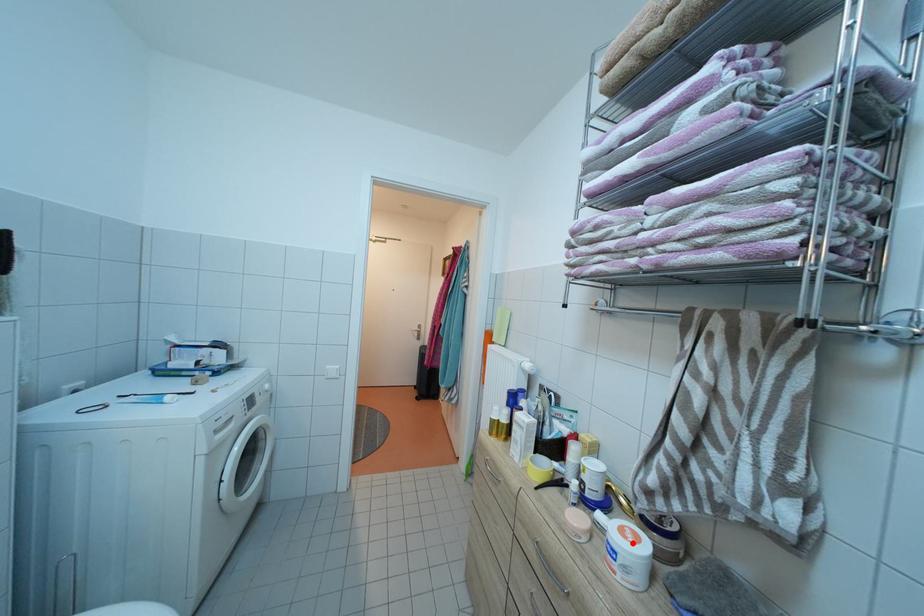
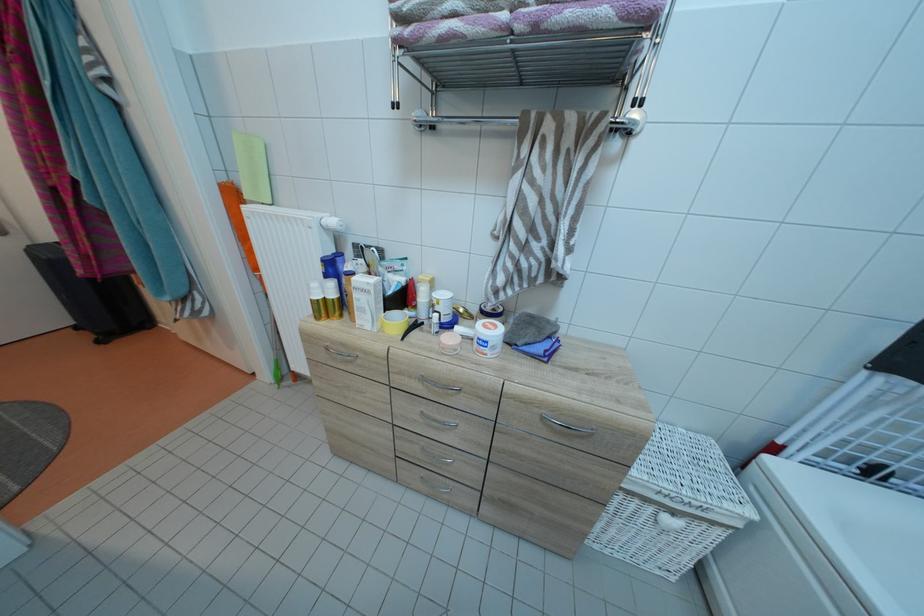
Find the pixel in the second image that matches the highlighted location in the first image.

(496, 334)